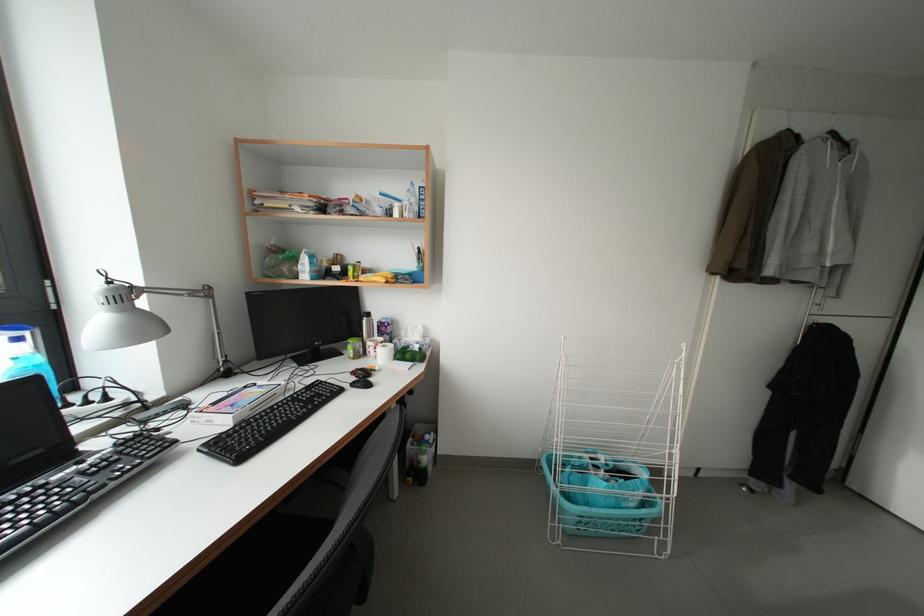
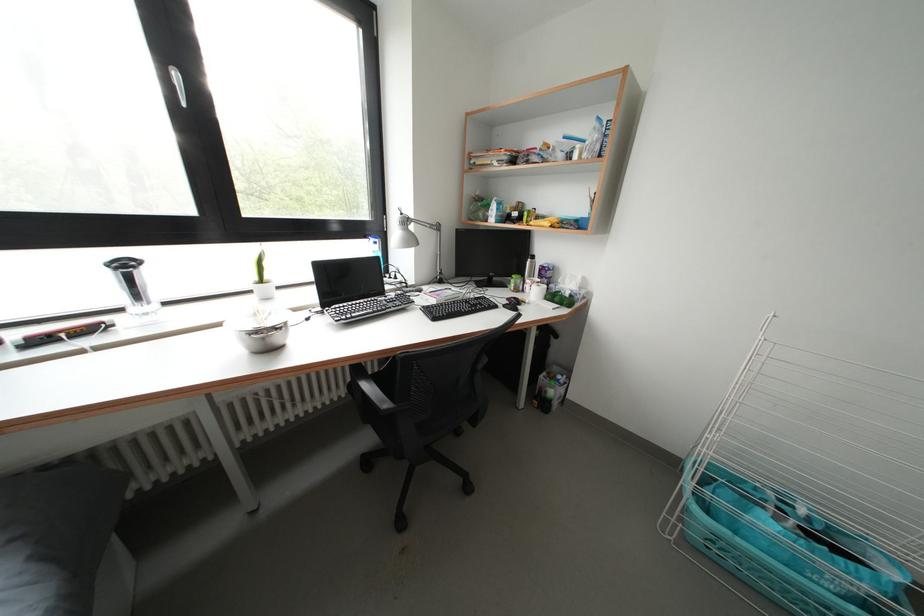
Where in the second image is the point corresponding to point 371,276 from the first image?

(544, 223)